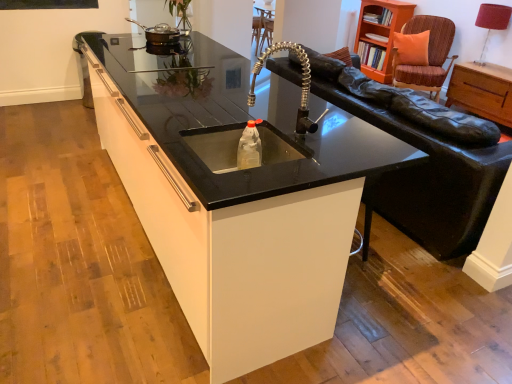
This screenshot has height=384, width=512. Find the location of `vacant area to the left of black granite sink at center`. vacant area to the left of black granite sink at center is located at coordinates (54, 196).